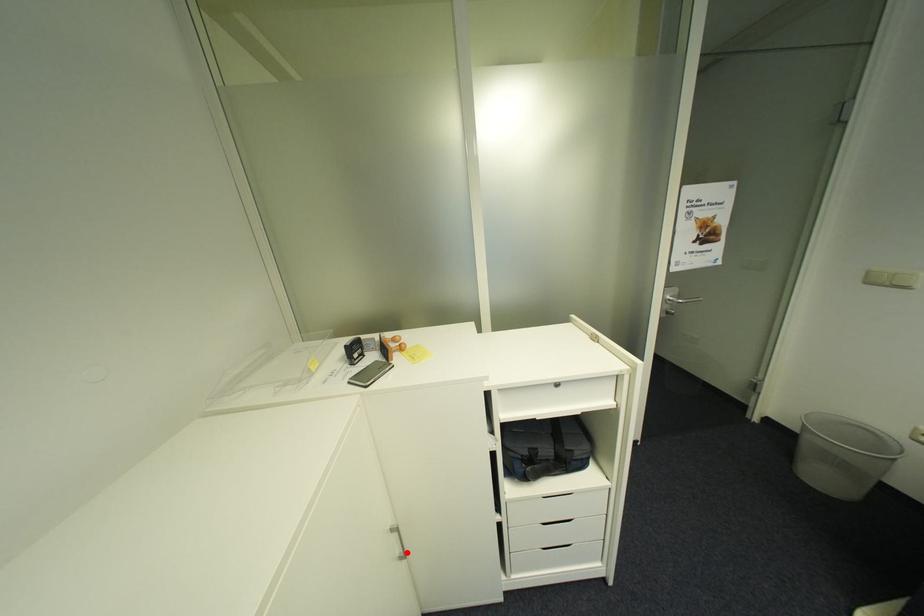
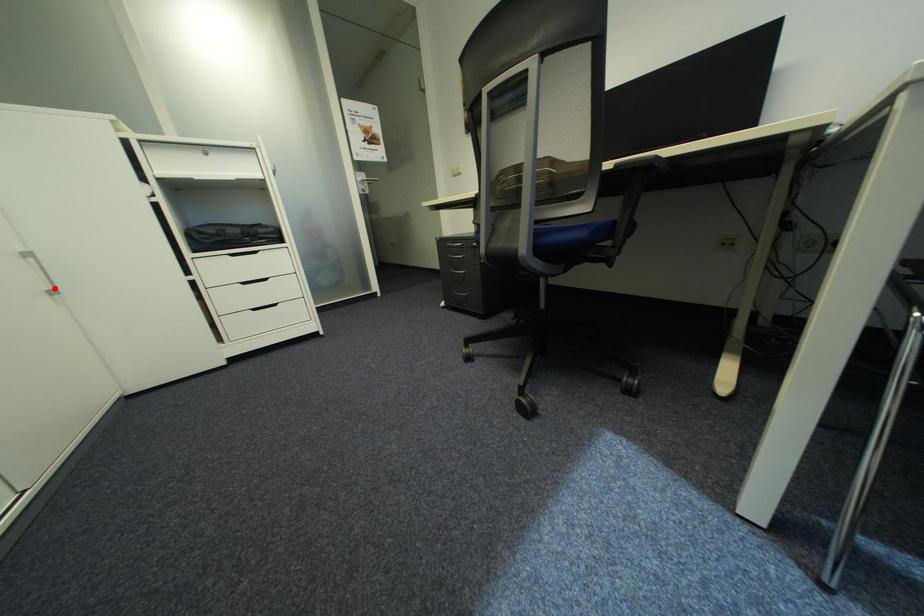
I am providing you with two images of the same scene from different viewpoints. A red point is marked on the first image and another point is marked on the second image. Is the marked point in image1 the same physical position as the marked point in image2?

Yes